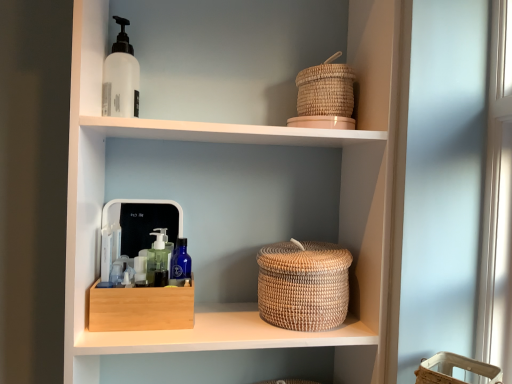
Question: Does white matte bottle at upper left contain natural woven basket at upper right?

Choices:
 (A) yes
 (B) no

Answer: (B)

Question: Is the position of white matte bottle at upper left less distant than that of natural woven basket at upper right?

Choices:
 (A) yes
 (B) no

Answer: (B)

Question: From the image's perspective, is white matte bottle at upper left located above natural woven basket at upper right?

Choices:
 (A) yes
 (B) no

Answer: (A)

Question: Considering the relative sizes of white matte bottle at upper left and natural woven basket at upper right in the image provided, is white matte bottle at upper left smaller than natural woven basket at upper right?

Choices:
 (A) yes
 (B) no

Answer: (A)

Question: Is white matte bottle at upper left positioned behind natural woven basket at upper right?

Choices:
 (A) no
 (B) yes

Answer: (B)

Question: Visually, is bamboo box at center positioned to the left or to the right of woven natural basket at center?

Choices:
 (A) left
 (B) right

Answer: (A)

Question: In the image, is bamboo box at center positioned in front of or behind woven natural basket at center?

Choices:
 (A) behind
 (B) front

Answer: (A)

Question: Considering the positions of bamboo box at center and woven natural basket at center in the image, is bamboo box at center wider or thinner than woven natural basket at center?

Choices:
 (A) thin
 (B) wide

Answer: (A)

Question: From a real-world perspective, relative to woven natural basket at center, is bamboo box at center vertically above or below?

Choices:
 (A) above
 (B) below

Answer: (B)

Question: Relative to natural woven basket at upper right, is woven natural basket at center in front or behind?

Choices:
 (A) front
 (B) behind

Answer: (B)

Question: Is woven natural basket at center bigger or smaller than natural woven basket at upper right?

Choices:
 (A) big
 (B) small

Answer: (B)

Question: Is point [306, 284] positioned closer to the camera than point [80, 115]?

Choices:
 (A) closer
 (B) farther

Answer: (B)

Question: In terms of width, does woven natural basket at center look wider or thinner when compared to natural woven basket at upper right?

Choices:
 (A) thin
 (B) wide

Answer: (A)

Question: From the image's perspective, is natural woven basket at upper right above or below woven natural basket at upper right, acting as the 2th basket starting from the right?

Choices:
 (A) below
 (B) above

Answer: (A)

Question: Based on their sizes in the image, would you say natural woven basket at upper right is bigger or smaller than woven natural basket at upper right, which ranks as the second basket in bottom-to-top order?

Choices:
 (A) big
 (B) small

Answer: (A)